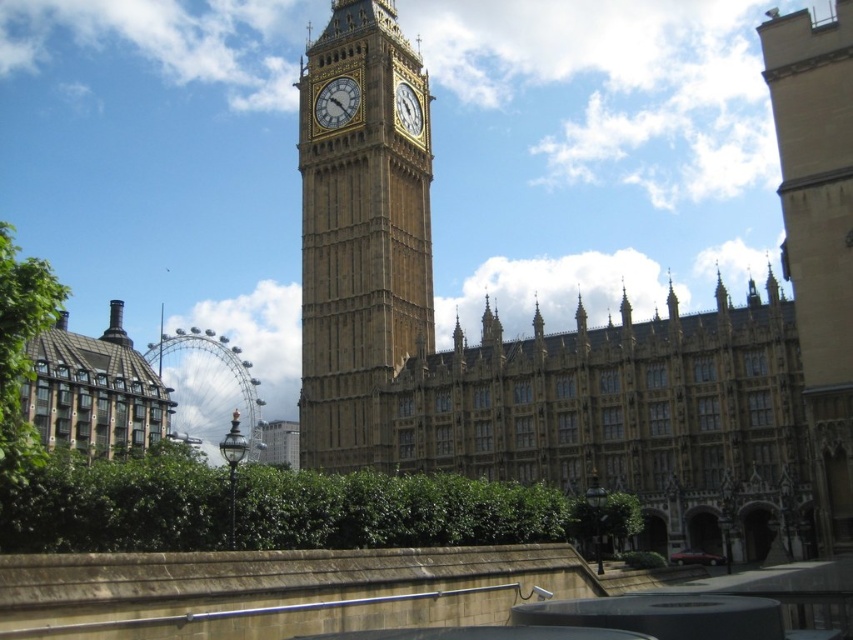
You are standing at the base of the Elizabeth Tower. You want to take a photo of the clock face and the Ferris wheel in the background. There is a specific point you need to align with the center of your camera frame, which is located at coordinates point (305,387). Considering your current distance from this point, will you need to move closer or farther away to ensure the point is centered?

The point (305,387) is 83.60 meters away from you. To center it in your camera frame, you need to move closer to reduce the distance.

You are a tourist standing at the base of the golden stone clock tower at center and want to take a photo of the green textured building at lower left. Will the tower block your view of the building?

The golden stone clock tower at center is much taller than the green textured building at lower left, so it might block your view of the building depending on their positions.

You are a tourist visiting London and want to take a photo of both the gold textured clock at center and the gold stone clock at center. Which clock should you zoom in on to ensure both are clearly visible in the photo?

The gold textured clock at center is smaller than the gold stone clock at center, so you should zoom in on the gold stone clock at center to ensure both are clearly visible in the photo.